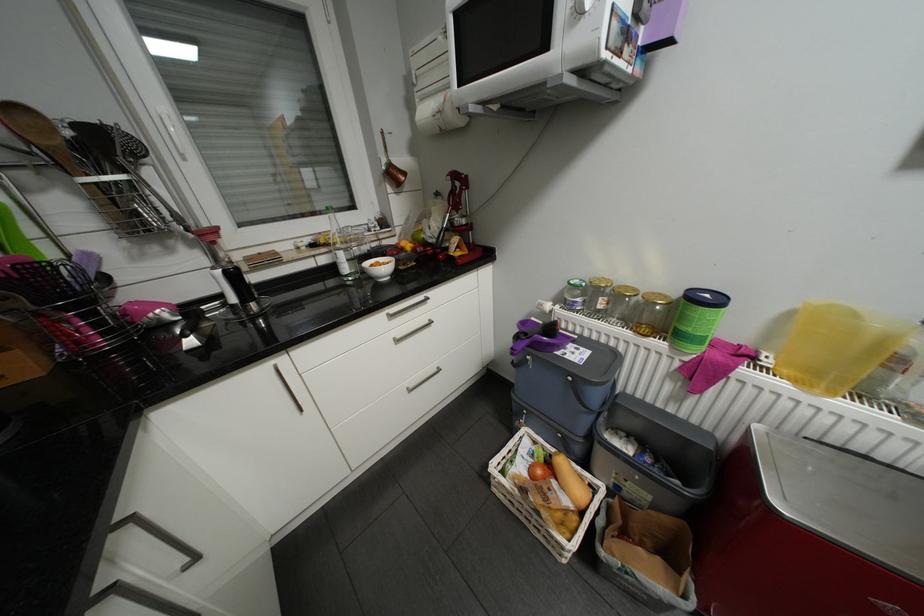
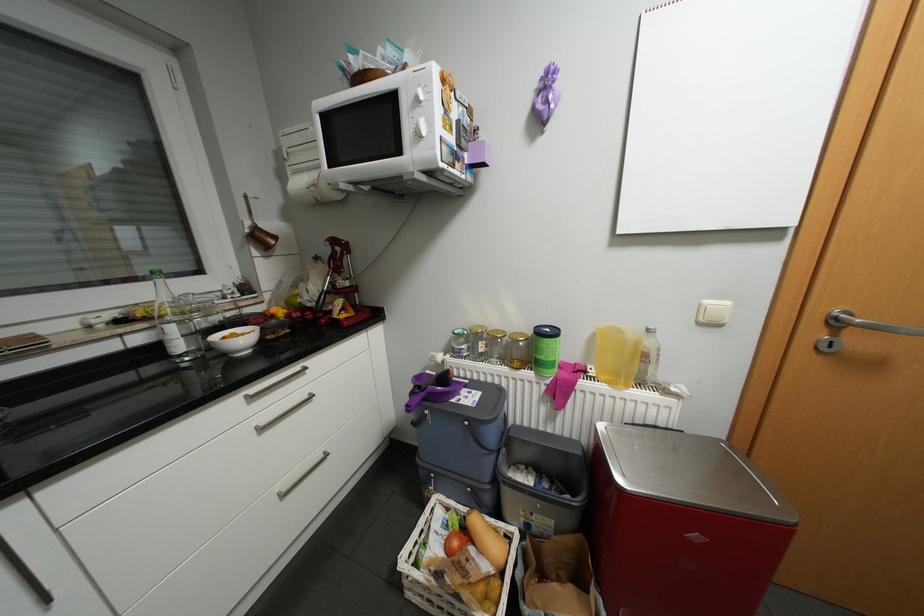
Locate, in the second image, the point that corresponds to (x=586, y=299) in the first image.

(471, 345)